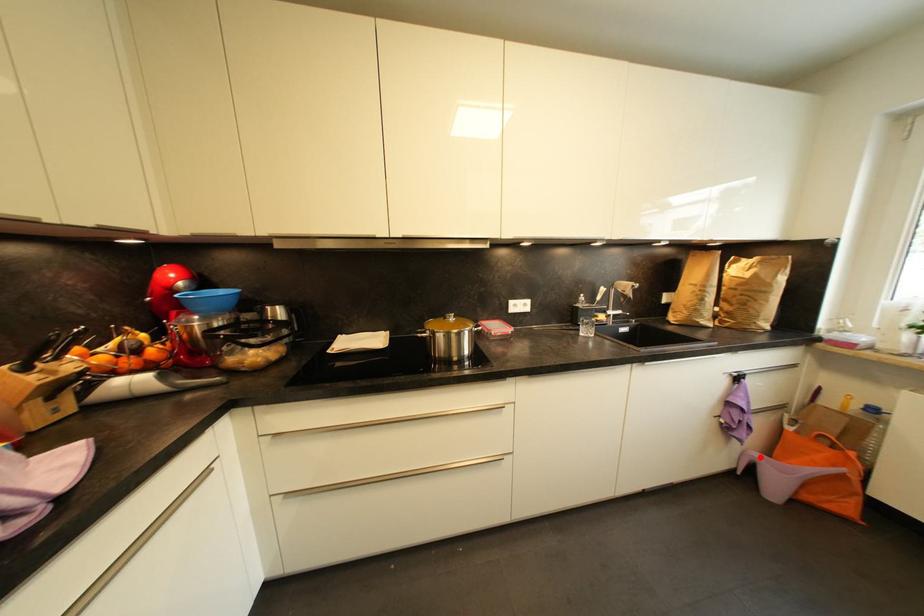
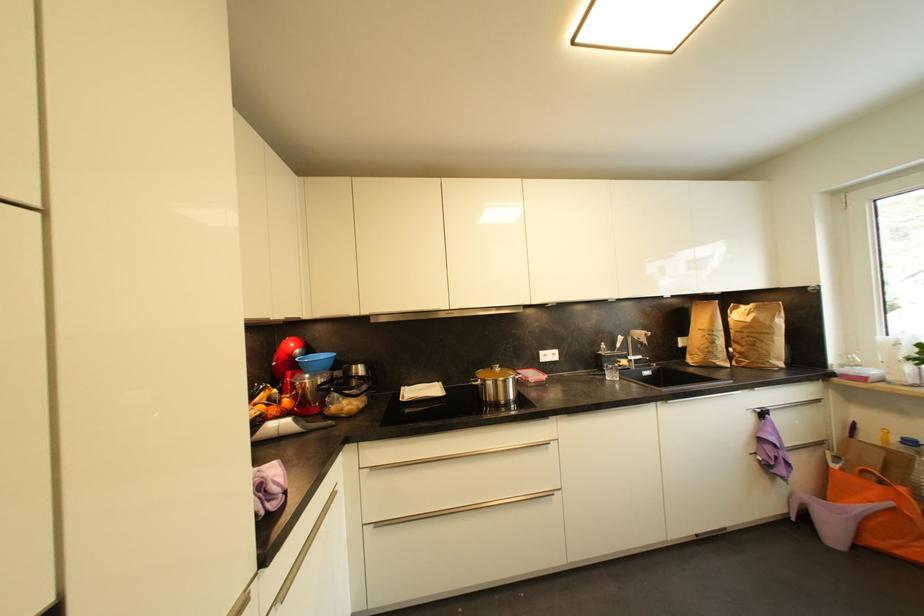
Question: I am providing you with two images of the same scene from different viewpoints. In image1, a red point is highlighted. Considering the same 3D point in image2, which of the following is correct?

Choices:
 (A) It is closer
 (B) It is farther

Answer: (A)